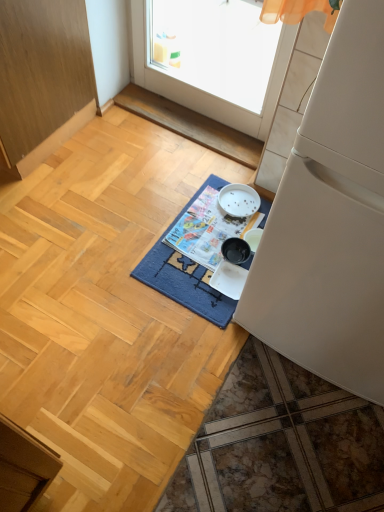
In order to face wooden cabinet at left, should I rotate leftwards or rightwards?

Rotate your view left by about 26.333°.

What is the approximate width of wooden cabinet at left?

It is 33.13 inches.

You are a GUI agent. You are given a task and a screenshot of the screen. Output one action in this format:
    pyautogui.click(x=<x>, y=<y>)
    Task: Click on the white matte refrigerator at right
    The width and height of the screenshot is (384, 512).
    Given the screenshot: What is the action you would take?
    pyautogui.click(x=330, y=221)

Measure the distance between point (191, 245) and camera.

Point (191, 245) is 5.38 feet from camera.

Identify the location of printed paper magazine at center. This screenshot has height=512, width=384. (209, 226).

Find the location of a particular element. wooden cabinet at left is located at coordinates (42, 79).

Considering the sizes of objects blue woven mat at center and white matte refrigerator at right in the image provided, who is smaller, blue woven mat at center or white matte refrigerator at right?

With smaller size is blue woven mat at center.

Could you tell me if blue woven mat at center is facing white matte refrigerator at right?

No, blue woven mat at center is not turned towards white matte refrigerator at right.

What's the angular difference between blue woven mat at center and white matte refrigerator at right's facing directions?

The angular difference between blue woven mat at center and white matte refrigerator at right is 0.434 degrees.

From the image's perspective, between blue woven mat at center and printed paper magazine at center, which one is located above?

printed paper magazine at center appears higher in the image.

Considering the positions of objects blue woven mat at center and printed paper magazine at center in the image provided, who is behind, blue woven mat at center or printed paper magazine at center?

printed paper magazine at center is behind.

This screenshot has height=512, width=384. Find the location of `magazine above the blue woven mat at center (from a real-world perspective)`. magazine above the blue woven mat at center (from a real-world perspective) is located at coordinates (209, 226).

From the image's perspective, which object appears higher, printed paper magazine at center or wooden cabinet at left?

From the image's view, wooden cabinet at left is above.

Looking at this image, could wooden cabinet at left be considered to be inside printed paper magazine at center?

Definitely not — wooden cabinet at left is not inside printed paper magazine at center.

Find the location of a particular element. This screenshot has width=384, height=512. magazine below the wooden cabinet at left (from the image's perspective) is located at coordinates (209, 226).

What's the angular difference between printed paper magazine at center and wooden cabinet at left's facing directions?

printed paper magazine at center and wooden cabinet at left are facing 1.5 degrees away from each other.

In the scene shown: Measure the distance from white matte refrigerator at right to blue woven mat at center.

white matte refrigerator at right is 17.23 inches from blue woven mat at center.

Where is `refrigerator on the right of blue woven mat at center`? The height and width of the screenshot is (512, 384). refrigerator on the right of blue woven mat at center is located at coordinates (330, 221).

From the picture: From a real-world perspective, is white matte refrigerator at right physically above blue woven mat at center?

Indeed, from a real-world perspective, white matte refrigerator at right stands above blue woven mat at center.

Is blue woven mat at center completely or partially inside white matte refrigerator at right?

No, blue woven mat at center is not a part of white matte refrigerator at right.

Measure the distance from white matte refrigerator at right to printed paper magazine at center.

white matte refrigerator at right is 53.89 centimeters from printed paper magazine at center.

Considering the relative positions of white matte refrigerator at right and printed paper magazine at center in the image provided, is white matte refrigerator at right to the left of printed paper magazine at center from the viewer's perspective?

In fact, white matte refrigerator at right is to the right of printed paper magazine at center.

From a real-world perspective, relative to printed paper magazine at center, is white matte refrigerator at right vertically above or below?

white matte refrigerator at right is above printed paper magazine at center.

From the image's perspective, is white matte refrigerator at right on top of printed paper magazine at center?

Correct, white matte refrigerator at right appears higher than printed paper magazine at center in the image.

Is white matte refrigerator at right positioned with its back to wooden cabinet at left?

No, wooden cabinet at left is not at the back of white matte refrigerator at right.

Does white matte refrigerator at right have a smaller size compared to wooden cabinet at left?

Indeed, white matte refrigerator at right has a smaller size compared to wooden cabinet at left.

Considering the positions of objects white matte refrigerator at right and wooden cabinet at left in the image provided, who is more to the right, white matte refrigerator at right or wooden cabinet at left?

From the viewer's perspective, white matte refrigerator at right appears more on the right side.

Are wooden cabinet at left and blue woven mat at center making contact?

They are not placed beside each other.

Where is `mat below the wooden cabinet at left (from a real-world perspective)`? The height and width of the screenshot is (512, 384). mat below the wooden cabinet at left (from a real-world perspective) is located at coordinates (185, 275).

Looking at this image, is wooden cabinet at left facing towards blue woven mat at center?

No, wooden cabinet at left does not turn towards blue woven mat at center.

Where is `refrigerator on the right of blue woven mat at center`? refrigerator on the right of blue woven mat at center is located at coordinates (330, 221).

Image resolution: width=384 pixels, height=512 pixels. What are the coordinates of `mat located on the left of printed paper magazine at center` in the screenshot? It's located at (185, 275).

Consider the image. Considering their positions, is blue woven mat at center positioned further to wooden cabinet at left than white matte refrigerator at right?

Among the two, white matte refrigerator at right is located further to wooden cabinet at left.

When comparing their distances from wooden cabinet at left, does blue woven mat at center or printed paper magazine at center seem further?

printed paper magazine at center is positioned further to the anchor wooden cabinet at left.

Based on their spatial positions, is printed paper magazine at center or white matte refrigerator at right further from wooden cabinet at left?

The object further to wooden cabinet at left is white matte refrigerator at right.

When comparing their distances from blue woven mat at center, does wooden cabinet at left or white matte refrigerator at right seem further?

wooden cabinet at left lies further to blue woven mat at center than the other object.

When comparing their distances from white matte refrigerator at right, does wooden cabinet at left or printed paper magazine at center seem closer?

Among the two, printed paper magazine at center is located nearer to white matte refrigerator at right.

From the image, which object appears to be farther from white matte refrigerator at right, printed paper magazine at center or blue woven mat at center?

Based on the image, printed paper magazine at center appears to be further to white matte refrigerator at right.

When comparing their distances from blue woven mat at center, does printed paper magazine at center or wooden cabinet at left seem further?

wooden cabinet at left.

From the image, which object appears to be farther from white matte refrigerator at right, blue woven mat at center or printed paper magazine at center?

Based on the image, printed paper magazine at center appears to be further to white matte refrigerator at right.

Find the location of a particular element. The height and width of the screenshot is (512, 384). mat between wooden cabinet at left and white matte refrigerator at right from left to right is located at coordinates (185, 275).

Locate an element on the screen. The width and height of the screenshot is (384, 512). magazine situated between wooden cabinet at left and white matte refrigerator at right from left to right is located at coordinates (209, 226).

Find the location of `mat between wooden cabinet at left and printed paper magazine at center`. mat between wooden cabinet at left and printed paper magazine at center is located at coordinates (185, 275).

I want to click on mat between white matte refrigerator at right and printed paper magazine at center from front to back, so click(x=185, y=275).